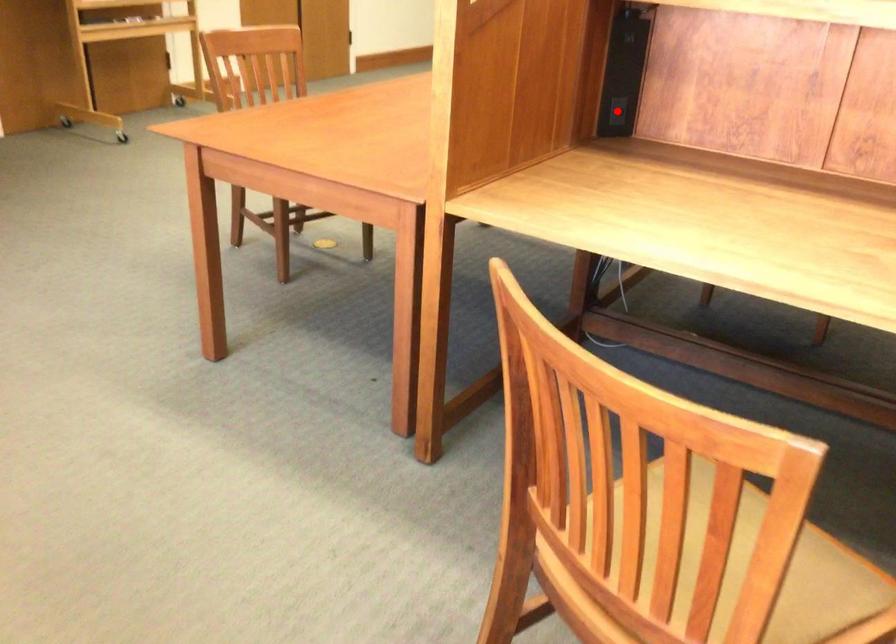
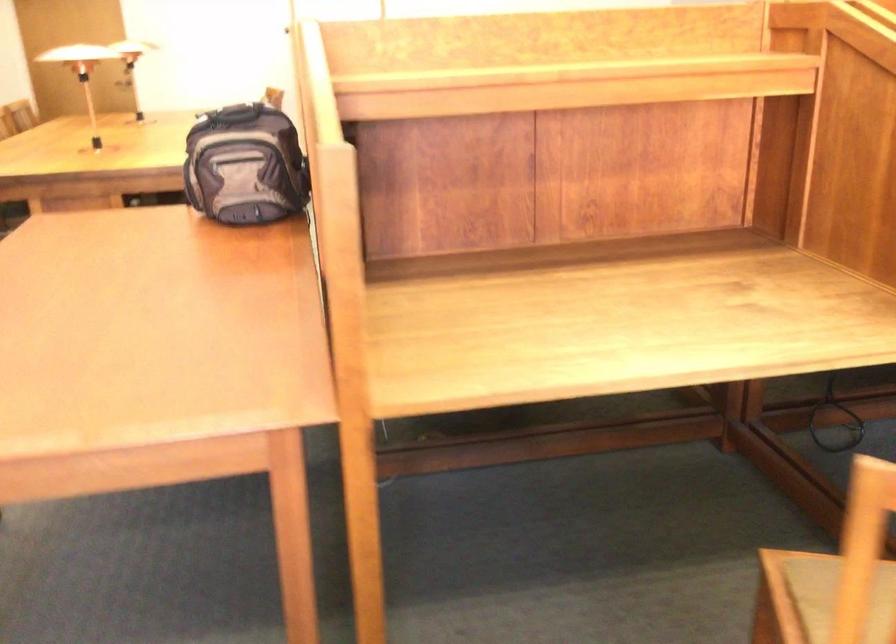
Question: I am providing you with two images of the same scene from different viewpoints. A red point is marked on the first image. At the location where the point appears in image 1, is it still visible in image 2?

Choices:
 (A) Yes
 (B) No

Answer: (B)